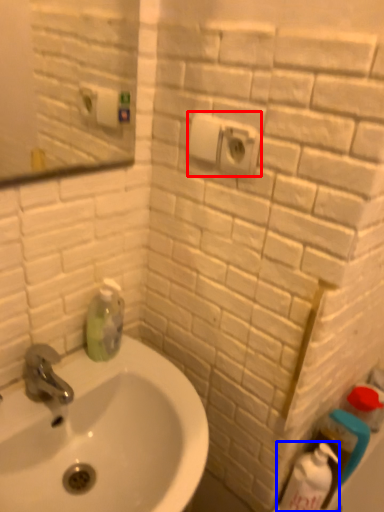
Question: Which point is closer to the camera, electric outlet (highlighted by a red box) or cleaning product (highlighted by a blue box)?

Choices:
 (A) electric outlet
 (B) cleaning product

Answer: (A)